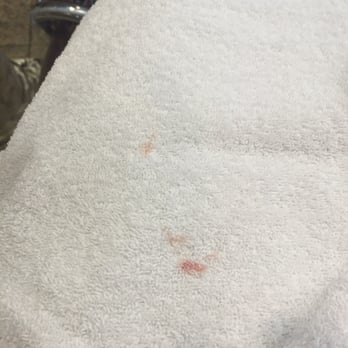
The width and height of the screenshot is (348, 348). Identify the location of faucet. (51, 10).